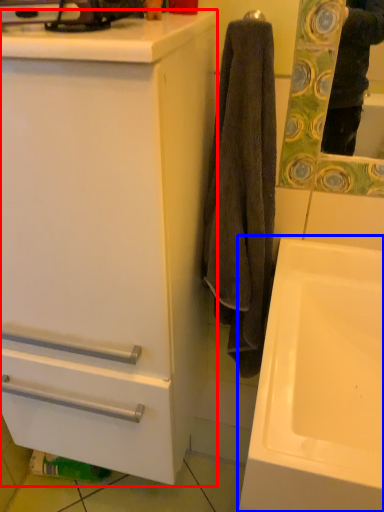
Question: Among these objects, which one is nearest to the camera, bathroom cabinet (highlighted by a red box) or sink (highlighted by a blue box)?

Choices:
 (A) bathroom cabinet
 (B) sink

Answer: (A)